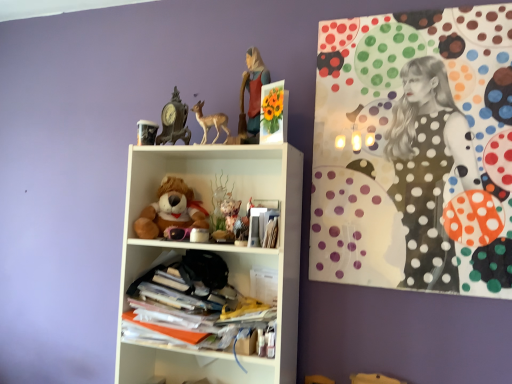
The height and width of the screenshot is (384, 512). I want to click on vacant area on top of white matte shelf at center, placed as the 2th shelf when sorted from bottom to top (from a real-world perspective), so click(x=216, y=148).